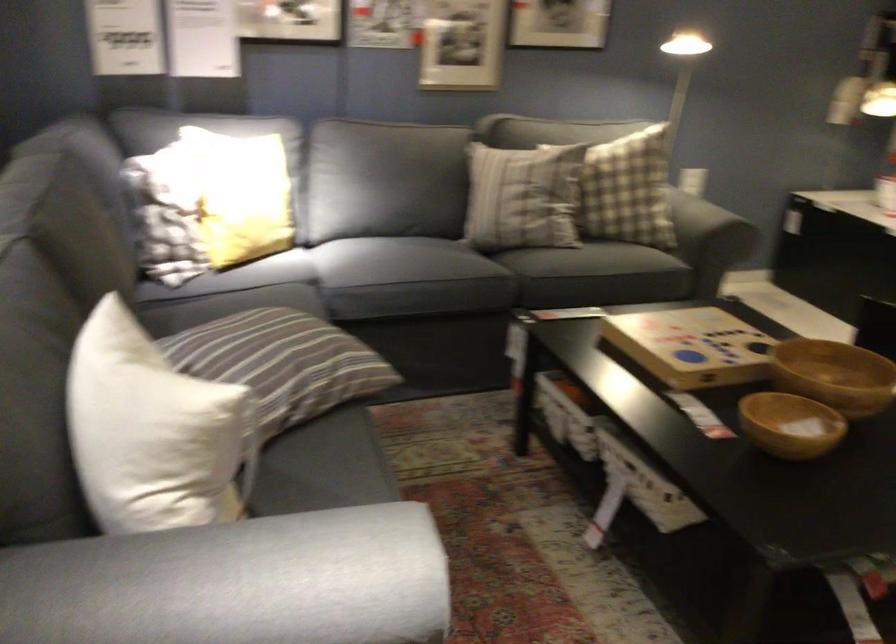
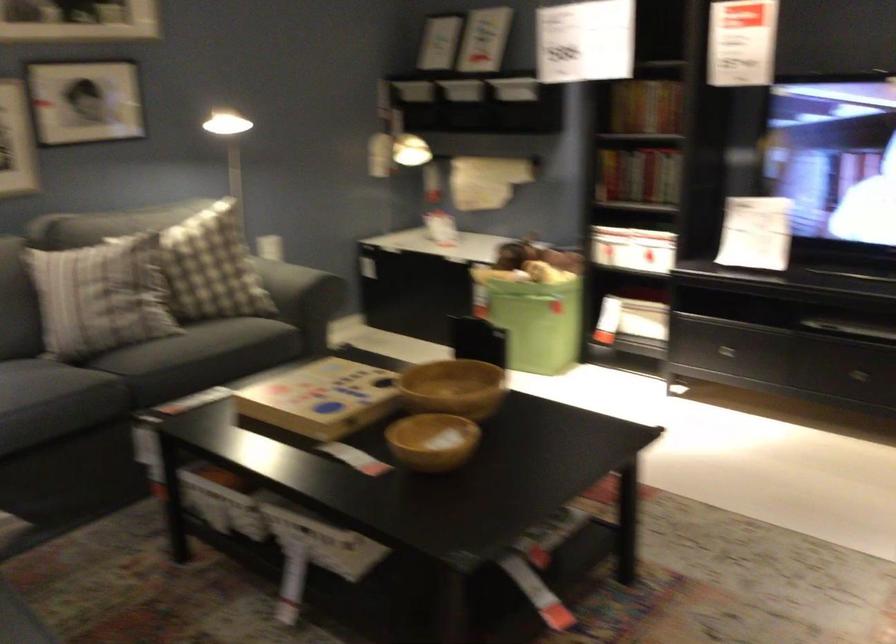
Question: The images are taken continuously from a first-person perspective. In which direction is your viewpoint rotating?

Choices:
 (A) Left
 (B) Right
 (C) Up
 (D) Down

Answer: (B)